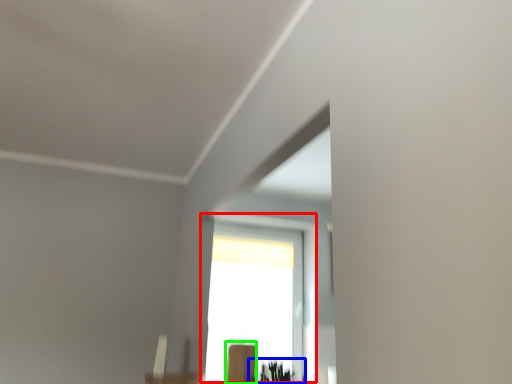
Question: Which is farther away from window (highlighted by a red box)? plant (highlighted by a blue box) or furniture (highlighted by a green box)?

Choices:
 (A) plant
 (B) furniture

Answer: (A)